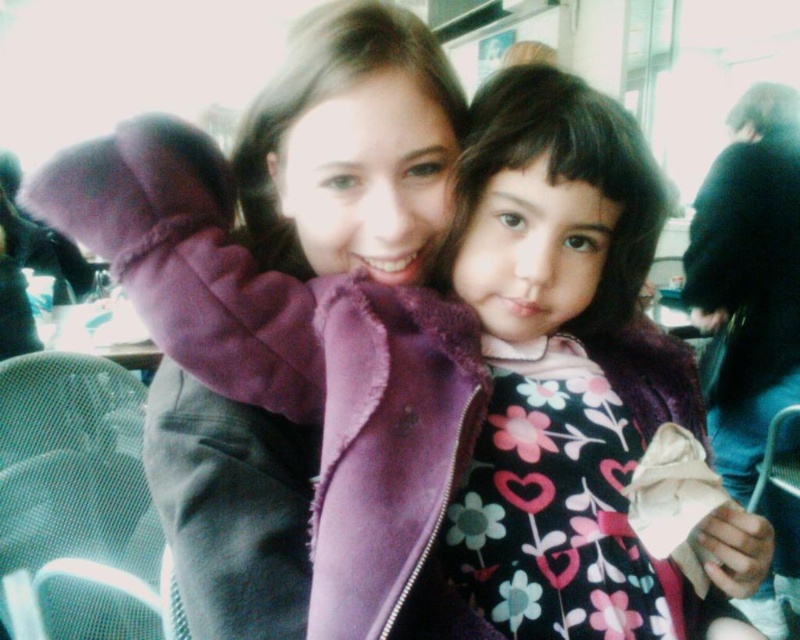
You are standing in the same room as the two people in the image. If you want to see both the point at (618, 264) and the point at (377, 374), which point should you look at first to ensure you can see both?

You should look at point (377, 374) first because point (618, 264) is behind it. By focusing on the closer point first, you can then adjust your gaze to include the point behind it in your field of view.

Based on the photo, you are a photographer setting up for a family portrait. You have a camera with a 6 inch wide lens. You need to position the floral dress at center and the purple fleece jacket at upper center so that the lens can capture both items without any overlap. Given their current distance, will the lens be wide enough to include both items in the frame?

The floral dress at center is 5.76 inches from the purple fleece jacket at upper center. Since the lens is 6 inches wide, it can comfortably capture both items without overlap as the distance between them is less than the lens width.